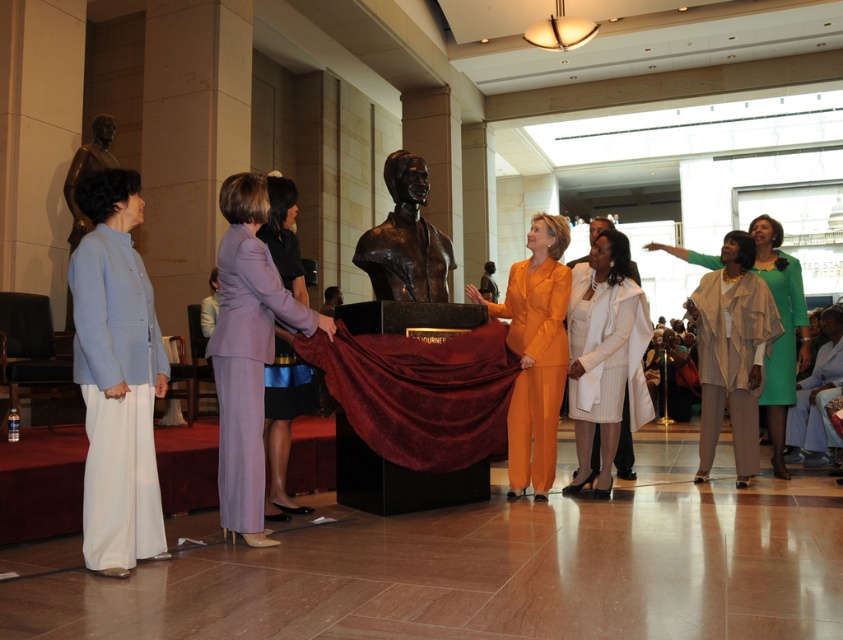
You are a photographer at the ceremony and need to adjust your camera settings to focus on the two individuals at the center. Which of the two, the lavender fabric suit at center or the white pinstripe coat at center, requires you to adjust the focus higher due to their height?

The lavender fabric suit at center is taller than the white pinstripe coat at center, so you should adjust the focus higher for the lavender fabric suit at center.

You are attending the unveiling ceremony and want to greet the person in the white pinstripe coat at center and the person in the beige textured coat at right. Which person should you approach first if you are standing at the entrance facing the bust?

You should approach the person in the white pinstripe coat at center first because they are closer to you than the beige textured coat at right, which is further away.